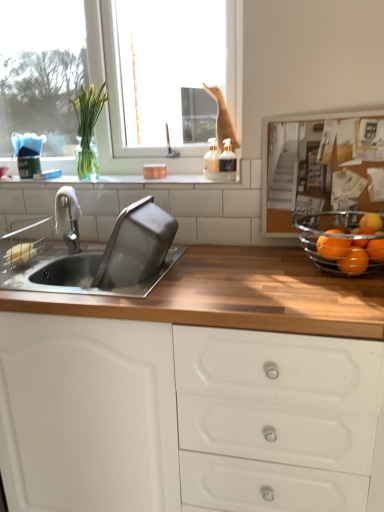
Identify the location of vacant area on top of white matte cabinet at center (from a real-world perspective). The height and width of the screenshot is (512, 384). (227, 273).